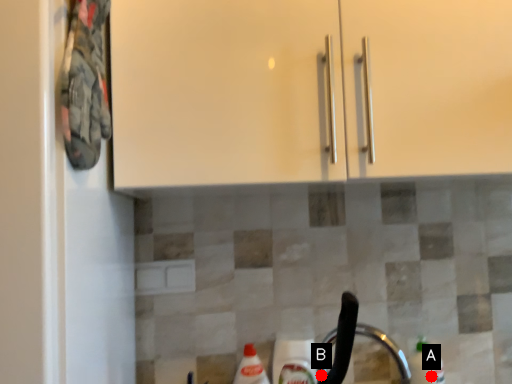
Question: Two points are circled on the image, labeled by A and B beside each circle. Which point is further to the camera?

Choices:
 (A) A is further
 (B) B is further

Answer: (A)